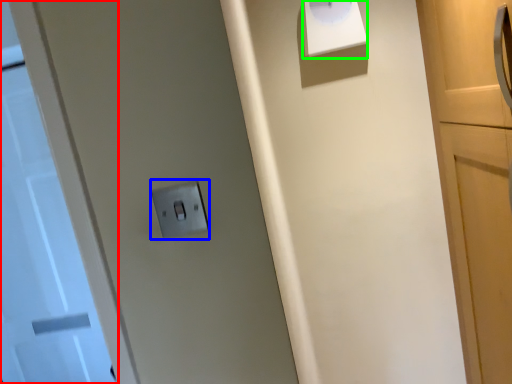
Question: Considering the real-world distances, which object is closest to door (highlighted by a red box)? light switch (highlighted by a blue box) or wide (highlighted by a green box).

Choices:
 (A) light switch
 (B) wide

Answer: (B)